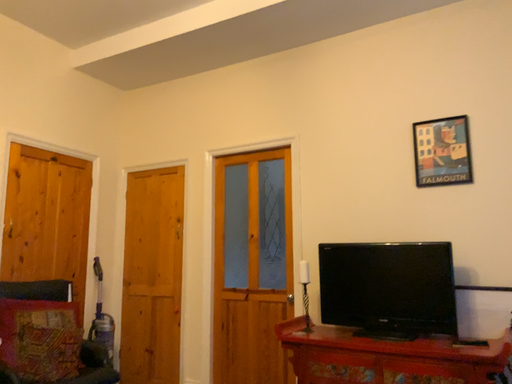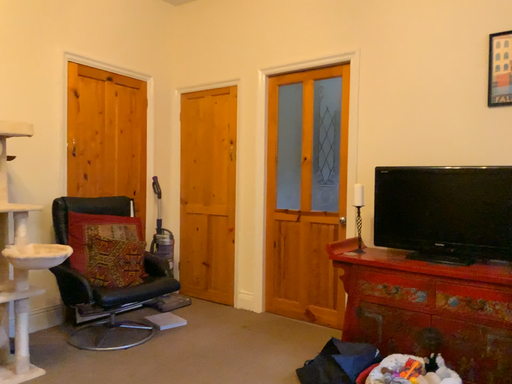
Question: How did the camera likely rotate when shooting the video?

Choices:
 (A) rotated downward
 (B) rotated upward

Answer: (A)